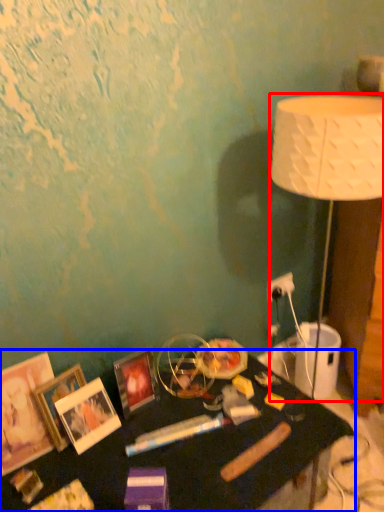
Question: Which object appears farthest to the camera in this image, lamp (highlighted by a red box) or table (highlighted by a blue box)?

Choices:
 (A) lamp
 (B) table

Answer: (A)